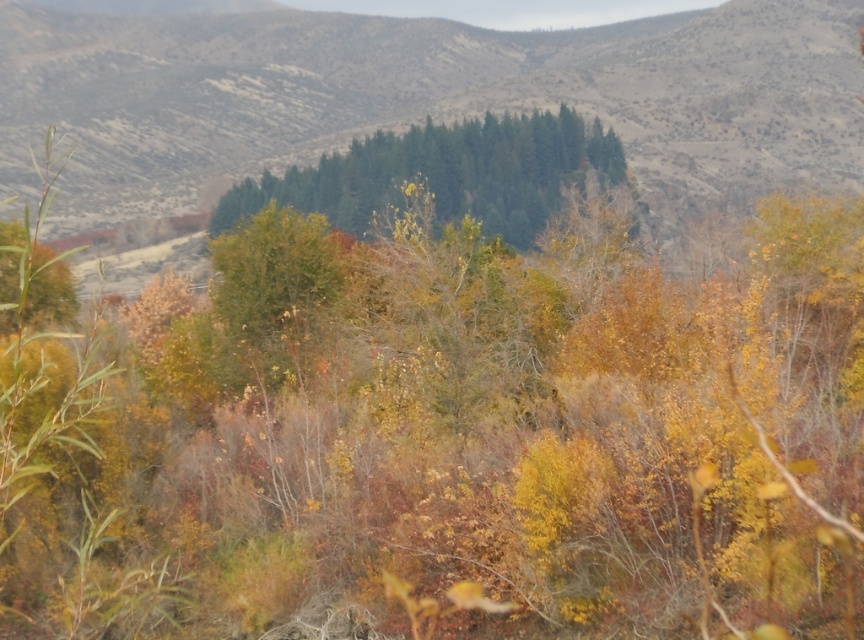
Question: Does green textured trees at center have a smaller size compared to green matte trees at center?

Choices:
 (A) no
 (B) yes

Answer: (A)

Question: Among these points, which one is nearest to the camera?

Choices:
 (A) (545, 176)
 (B) (810, 115)

Answer: (A)

Question: Among these objects, which one is nearest to the camera?

Choices:
 (A) green textured trees at center
 (B) green matte trees at center

Answer: (B)

Question: Is the position of green textured trees at center more distant than that of green matte trees at center?

Choices:
 (A) no
 (B) yes

Answer: (B)

Question: Can you confirm if green textured trees at center is wider than green matte trees at center?

Choices:
 (A) yes
 (B) no

Answer: (A)